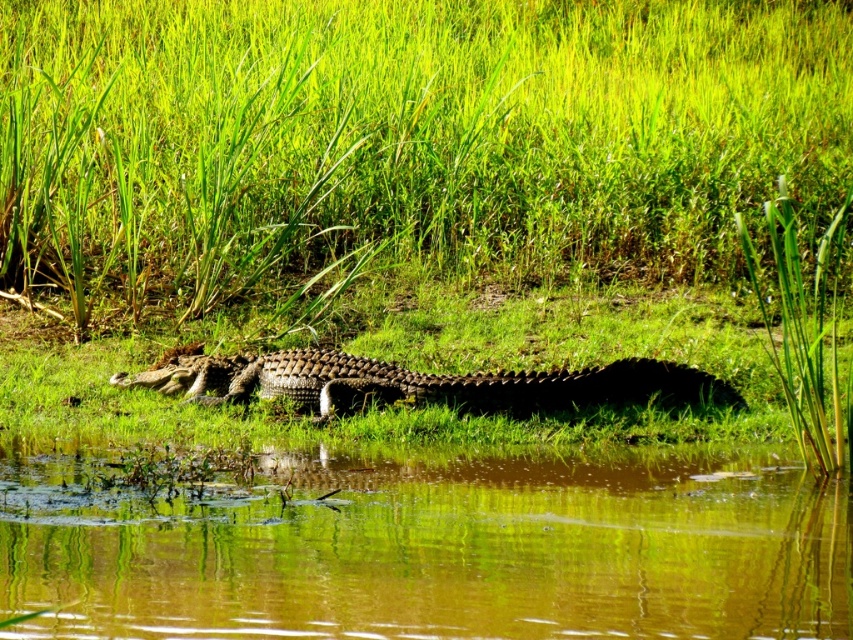
Between green grass at center and brown murky water at center, which one appears on the left side from the viewer's perspective?

green grass at center is more to the left.

Who is more distant from viewer, (683, 141) or (813, 593)?

The point (683, 141) is behind.

Identify the location of green grass at center. (403, 140).

Is brown murky water at center taller than shiny brown crocodile at center?

Incorrect, brown murky water at center's height is not larger of shiny brown crocodile at center's.

Can you confirm if brown murky water at center is positioned to the right of shiny brown crocodile at center?

Correct, you'll find brown murky water at center to the right of shiny brown crocodile at center.

Does point (292, 483) come in front of point (292, 369)?

Yes, it is.

The width and height of the screenshot is (853, 640). I want to click on brown murky water at center, so click(x=457, y=552).

Based on the photo, who is taller, green grass at center or shiny brown crocodile at center?

With more height is green grass at center.

At what (x,y) coordinates should I click in order to perform the action: click on green grass at center. Please return your answer as a coordinate pair (x, y). The image size is (853, 640). Looking at the image, I should click on (403, 140).

At what (x,y) coordinates should I click in order to perform the action: click on green grass at center. Please return your answer as a coordinate pair (x, y). Looking at the image, I should click on pyautogui.click(x=403, y=140).